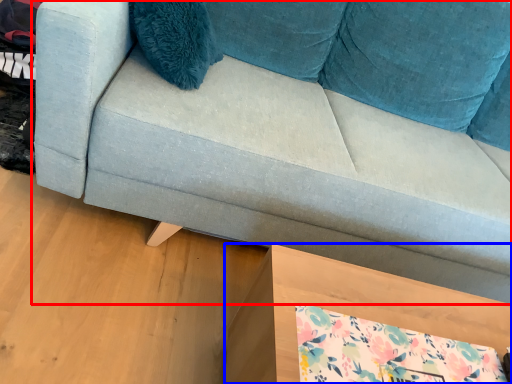
Question: Which of the following is the farthest to the observer, studio couch (highlighted by a red box) or table (highlighted by a blue box)?

Choices:
 (A) studio couch
 (B) table

Answer: (B)